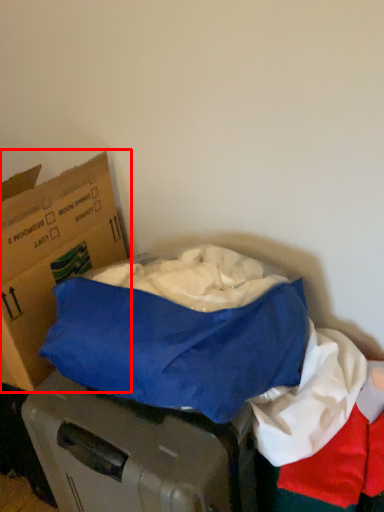
Question: From the image's perspective, what is the correct spatial positioning of box (annotated by the red box) in reference to linen?

Choices:
 (A) below
 (B) above

Answer: (B)